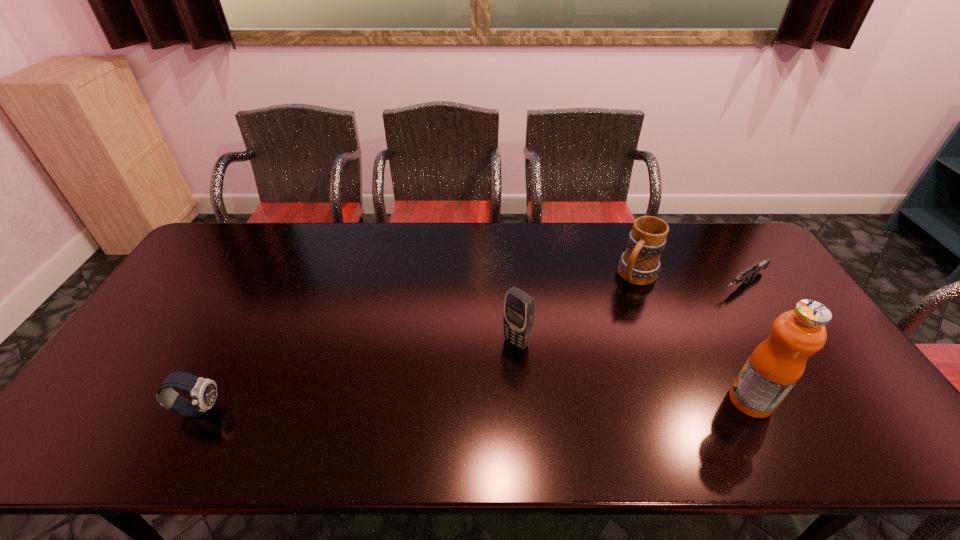
Identify the location of watch. The height and width of the screenshot is (540, 960). (203, 391).

The width and height of the screenshot is (960, 540). What are the coordinates of `the second shortest object` in the screenshot? It's located at point(203,391).

At what (x,y) coordinates should I click in order to perform the action: click on the tallest object. Please return your answer as a coordinate pair (x, y). The image size is (960, 540). Looking at the image, I should click on (774, 367).

Locate an element on the screen. the second object from right to left is located at coordinates (774, 367).

Locate an element on the screen. mug is located at coordinates (640, 264).

Image resolution: width=960 pixels, height=540 pixels. Find the location of `cellular telephone`. cellular telephone is located at coordinates pyautogui.click(x=518, y=318).

Where is `the fourth object from right to left`? the fourth object from right to left is located at coordinates (518, 318).

You are a GUI agent. You are given a task and a screenshot of the screen. Output one action in this format:
    pyautogui.click(x=<x>, y=<y>)
    Task: Click on the rightmost object
    This screenshot has width=960, height=540.
    Given the screenshot: What is the action you would take?
    pyautogui.click(x=757, y=267)

This screenshot has width=960, height=540. I want to click on gun, so click(x=757, y=267).

Identify the location of vacant point located on the face of the leftmost object. The image size is (960, 540). (312, 409).